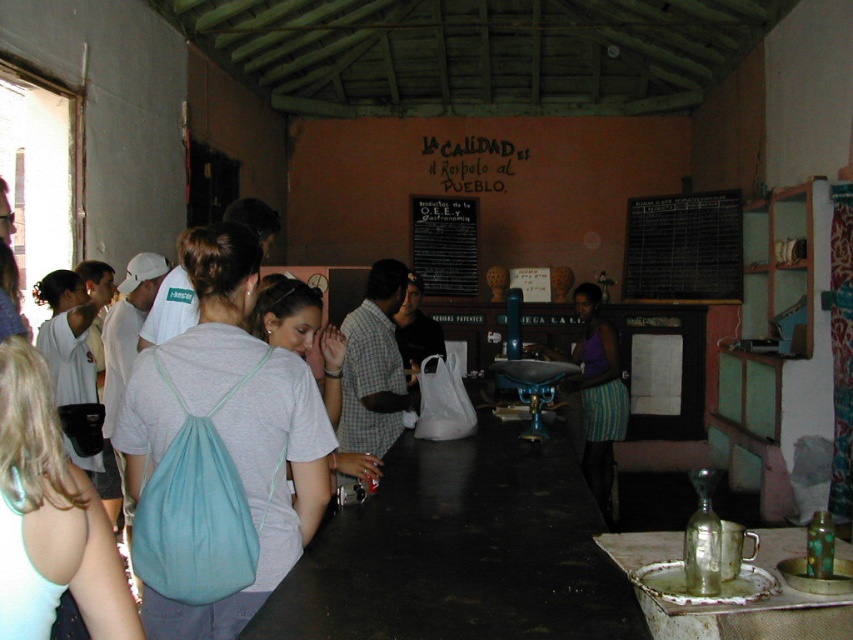
Question: Does teal fabric backpack at center appear under purple fabric skirt at center?

Choices:
 (A) no
 (B) yes

Answer: (A)

Question: Estimate the real-world distances between objects in this image. Which object is farther from the white fabric backpack at center?

Choices:
 (A) black chalkboard at upper right
 (B) rusty metal tray at lower right

Answer: (A)

Question: Which point is farther to the camera?

Choices:
 (A) black chalkboard at upper right
 (B) teal fabric backpack at center
 (C) white fabric backpack at center
 (D) black matte table at center

Answer: (A)

Question: Does teal fabric backpack at center appear under black chalkboard at upper right?

Choices:
 (A) no
 (B) yes

Answer: (B)

Question: Which point appears farthest from the camera in this image?

Choices:
 (A) (714, 230)
 (B) (450, 289)
 (C) (579, 628)
 (D) (787, 593)

Answer: (B)

Question: Does white fabric backpack at center have a greater width compared to purple fabric skirt at center?

Choices:
 (A) no
 (B) yes

Answer: (A)